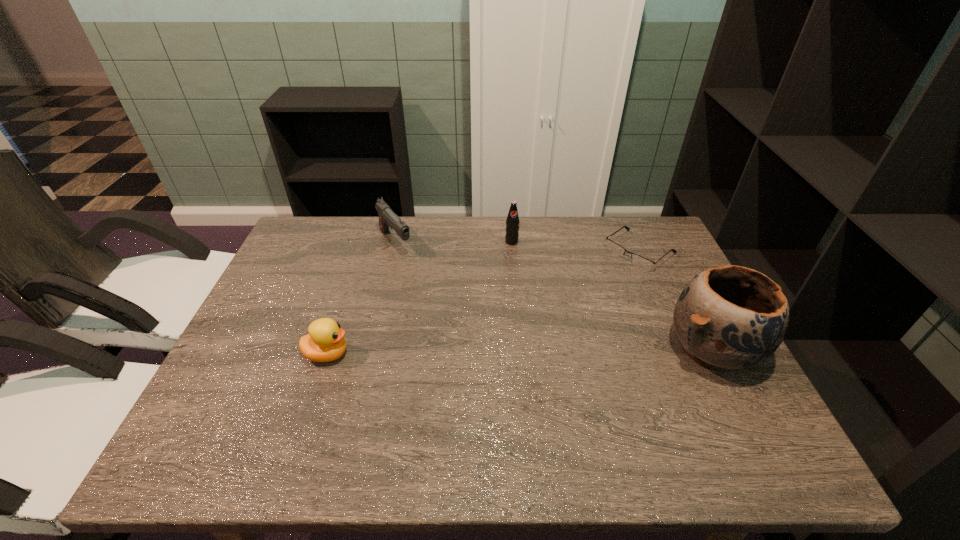
The width and height of the screenshot is (960, 540). I want to click on vacant area at the near right corner, so click(x=743, y=403).

You are a GUI agent. You are given a task and a screenshot of the screen. Output one action in this format:
    pyautogui.click(x=<x>, y=<y>)
    Task: Click on the empty space that is in between the second shortest object and the spectacles
    
    Given the screenshot: What is the action you would take?
    pyautogui.click(x=484, y=302)

At what (x,y) coordinates should I click in order to perform the action: click on vacant space that's between the pottery and the third object from left to right. Please return your answer as a coordinate pair (x, y). This screenshot has width=960, height=540. Looking at the image, I should click on (612, 295).

I want to click on free point between the gun and the duckling, so click(x=362, y=299).

What are the coordinates of `vacant area that lies between the spectacles and the fourth tallest object` in the screenshot? It's located at click(x=484, y=302).

Identify the location of unoccupied position between the gun and the shortest object. The height and width of the screenshot is (540, 960). (517, 247).

Identify the location of free space between the third object from left to right and the gun. The image size is (960, 540). (453, 242).

Locate an element on the screen. free space between the spectacles and the third object from left to right is located at coordinates (576, 246).

Find the location of a particular element. This screenshot has width=960, height=540. free space that is in between the gun and the third object from left to right is located at coordinates (453, 242).

Where is `empty space between the duckling and the pop`? This screenshot has height=540, width=960. empty space between the duckling and the pop is located at coordinates (420, 298).